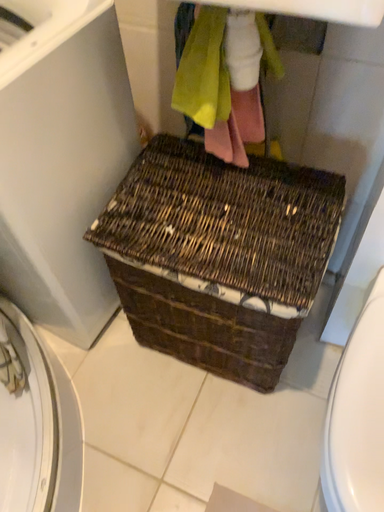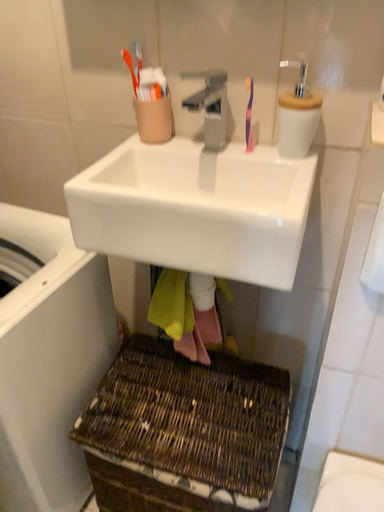
Question: How did the camera likely rotate when shooting the video?

Choices:
 (A) rotated downward
 (B) rotated upward

Answer: (B)